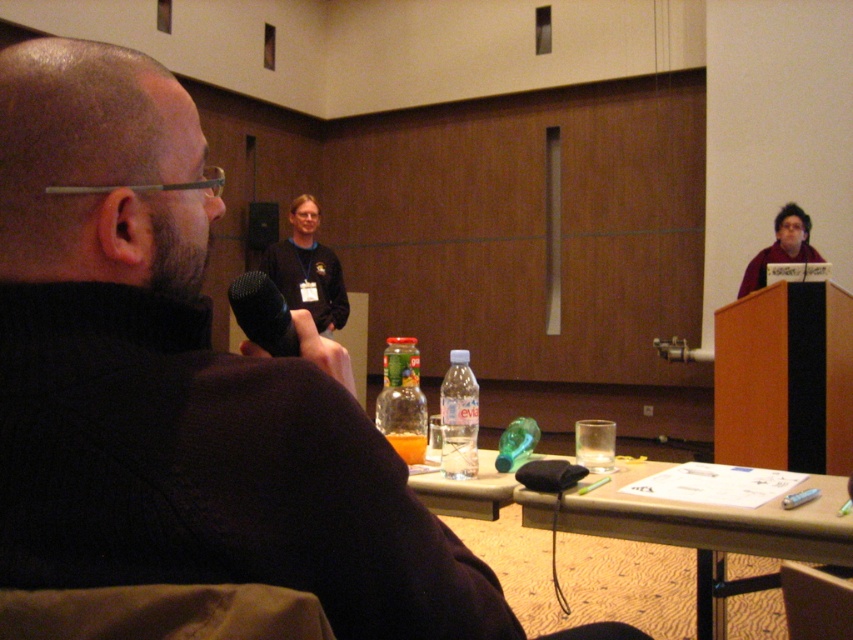
Question: Among these objects, which one is nearest to the camera?

Choices:
 (A) clear plastic bottle at center
 (B) matte purple sweater at upper right
 (C) dark blue sweater at center

Answer: (A)

Question: Which of the following is the closest to the observer?

Choices:
 (A) dark blue sweater at center
 (B) wooden table at lower center
 (C) matte purple sweater at upper right

Answer: (B)

Question: Where is translucent glass bottle at center located in relation to black matte microphone at center in the image?

Choices:
 (A) left
 (B) right

Answer: (B)

Question: Is dark blue sweater at center to the left of black matte microphone at center from the viewer's perspective?

Choices:
 (A) no
 (B) yes

Answer: (B)

Question: Is dark blue sweater at center below translucent glass bottle at center?

Choices:
 (A) no
 (B) yes

Answer: (A)

Question: Which point is closer to the camera?

Choices:
 (A) matte purple sweater at upper right
 (B) translucent glass bottle at center
 (C) black matte microphone at center
 (D) wooden table at lower center

Answer: (C)